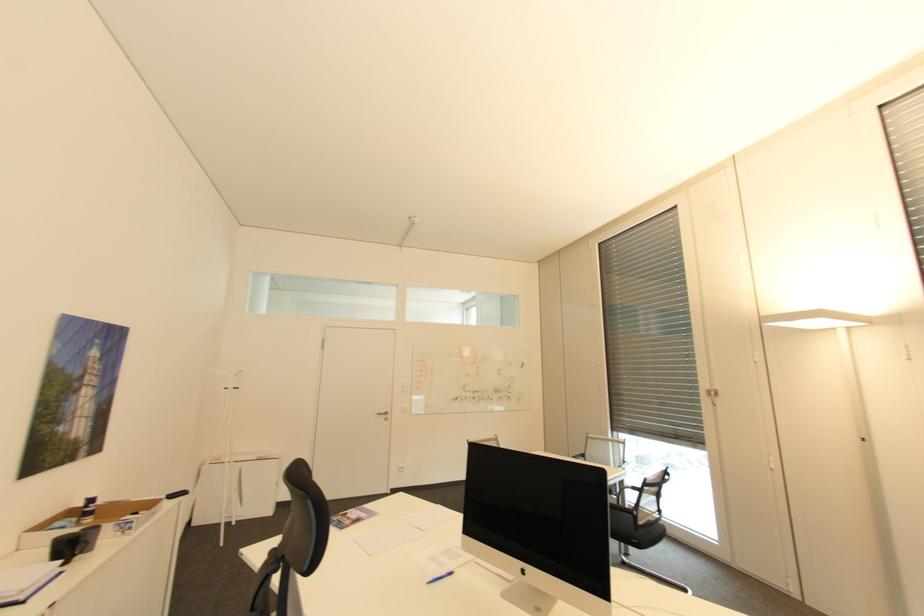
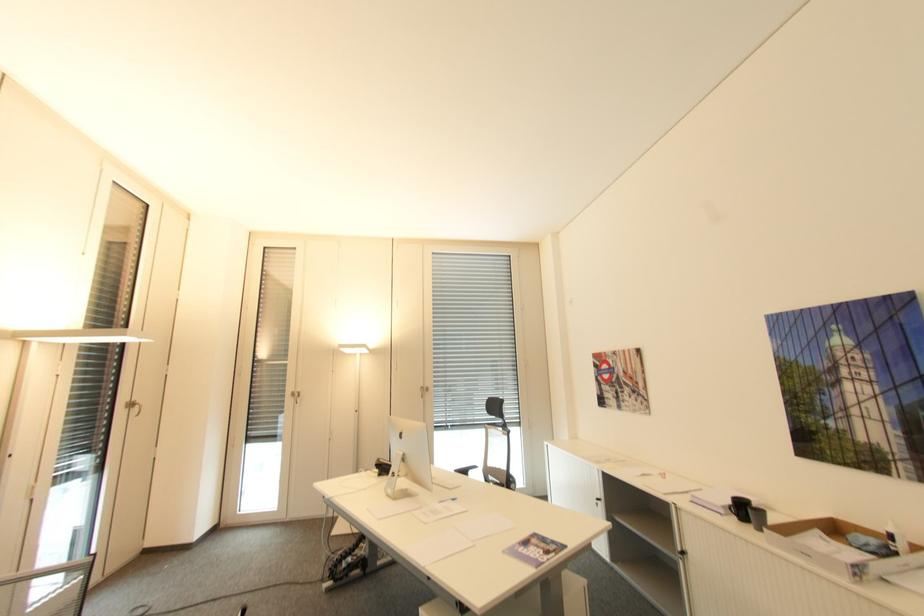
Locate, in the second image, the point that corresponds to (x=99, y=499) in the first image.

(895, 537)